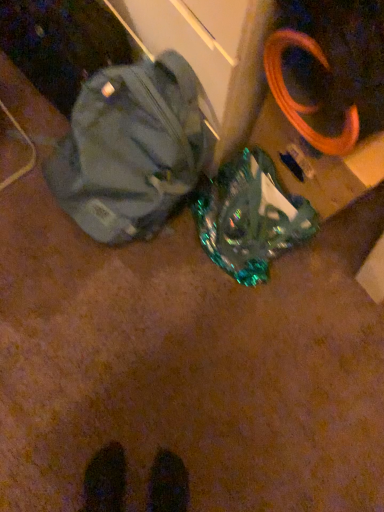
Image resolution: width=384 pixels, height=512 pixels. I want to click on matte gray backpack at center, so click(132, 148).

What do you see at coordinates (132, 148) in the screenshot? I see `matte gray backpack at center` at bounding box center [132, 148].

Measure the distance between matte gray backpack at center and camera.

They are 31.77 inches apart.

I want to click on holographic plastic bag at center, so click(x=251, y=218).

Describe the element at coordinates (251, 218) in the screenshot. I see `holographic plastic bag at center` at that location.

Identify the location of matte gray backpack at center. (132, 148).

Can you confirm if matte gray backpack at center is positioned to the left of holographic plastic bag at center?

Indeed, matte gray backpack at center is positioned on the left side of holographic plastic bag at center.

Considering the positions of objects matte gray backpack at center and holographic plastic bag at center in the image provided, who is behind, matte gray backpack at center or holographic plastic bag at center?

holographic plastic bag at center is more distant.

Is point (110, 118) less distant than point (198, 229)?

Yes, it is in front of point (198, 229).

From the image's perspective, is matte gray backpack at center above or below holographic plastic bag at center?

Based on their image positions, matte gray backpack at center is located above holographic plastic bag at center.

From a real-world perspective, is matte gray backpack at center positioned above or below holographic plastic bag at center?

matte gray backpack at center is above holographic plastic bag at center.

In terms of width, does matte gray backpack at center look wider or thinner when compared to holographic plastic bag at center?

matte gray backpack at center is wider than holographic plastic bag at center.

Which of these two, matte gray backpack at center or holographic plastic bag at center, stands taller?

matte gray backpack at center.

Between matte gray backpack at center and holographic plastic bag at center, which one has smaller size?

holographic plastic bag at center is smaller.

Is matte gray backpack at center outside of holographic plastic bag at center?

Yes, matte gray backpack at center is outside of holographic plastic bag at center.

Is matte gray backpack at center beside holographic plastic bag at center?

No, matte gray backpack at center is not with holographic plastic bag at center.

Is matte gray backpack at center turned away from holographic plastic bag at center?

No, matte gray backpack at center is not facing away from holographic plastic bag at center.

How many degrees apart are the facing directions of matte gray backpack at center and holographic plastic bag at center?

The facing directions of matte gray backpack at center and holographic plastic bag at center are 0.0195 degrees apart.

The width and height of the screenshot is (384, 512). What are the coordinates of `luggage and bags behind the matte gray backpack at center` in the screenshot? It's located at (251, 218).

Is holographic plastic bag at center to the right of matte gray backpack at center from the viewer's perspective?

Correct, you'll find holographic plastic bag at center to the right of matte gray backpack at center.

In the image, is holographic plastic bag at center positioned in front of or behind matte gray backpack at center?

Clearly, holographic plastic bag at center is behind matte gray backpack at center.

Does point (251, 277) come behind point (208, 103)?

Yes, point (251, 277) is behind point (208, 103).

From the image's perspective, is holographic plastic bag at center on matte gray backpack at center?

No, from the image's perspective, holographic plastic bag at center is not on top of matte gray backpack at center.

From a real-world perspective, does holographic plastic bag at center sit lower than matte gray backpack at center?

Yes, from a real-world perspective, holographic plastic bag at center is under matte gray backpack at center.

Between holographic plastic bag at center and matte gray backpack at center, which one has smaller width?

Thinner between the two is holographic plastic bag at center.

Can you confirm if holographic plastic bag at center is taller than matte gray backpack at center?

No, holographic plastic bag at center is not taller than matte gray backpack at center.

In terms of size, does holographic plastic bag at center appear bigger or smaller than matte gray backpack at center?

Considering their sizes, holographic plastic bag at center takes up less space than matte gray backpack at center.

Could matte gray backpack at center be considered to be inside holographic plastic bag at center?

No, holographic plastic bag at center does not contain matte gray backpack at center.

Are holographic plastic bag at center and matte gray backpack at center far apart?

That's not correct — holographic plastic bag at center is a little close to matte gray backpack at center.

Looking at this image, could you tell me if holographic plastic bag at center is facing matte gray backpack at center?

No, holographic plastic bag at center is not turned towards matte gray backpack at center.

How different are the orientations of holographic plastic bag at center and matte gray backpack at center in degrees?

They differ by 0.0195 degrees in their facing directions.

You are a GUI agent. You are given a task and a screenshot of the screen. Output one action in this format:
    pyautogui.click(x=<x>, y=<y>)
    Task: Click on the backpack in front of the holographic plastic bag at center
    This screenshot has height=512, width=384.
    Given the screenshot: What is the action you would take?
    pyautogui.click(x=132, y=148)

Where is `luggage and bags on the right of the matte gray backpack at center`? The width and height of the screenshot is (384, 512). luggage and bags on the right of the matte gray backpack at center is located at coordinates (251, 218).

What are the coordinates of `luggage and bags below the matte gray backpack at center (from a real-world perspective)` in the screenshot? It's located at (251, 218).